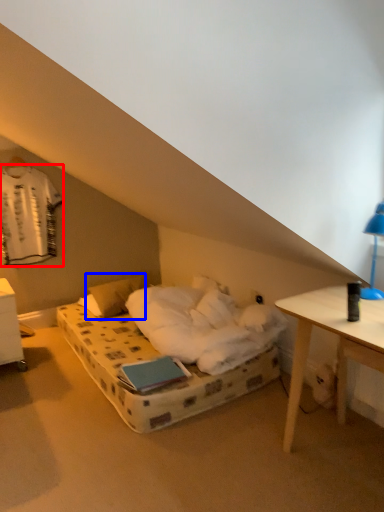
Question: Which point is closer to the camera, laundry (highlighted by a red box) or pillow (highlighted by a blue box)?

Choices:
 (A) laundry
 (B) pillow

Answer: (A)